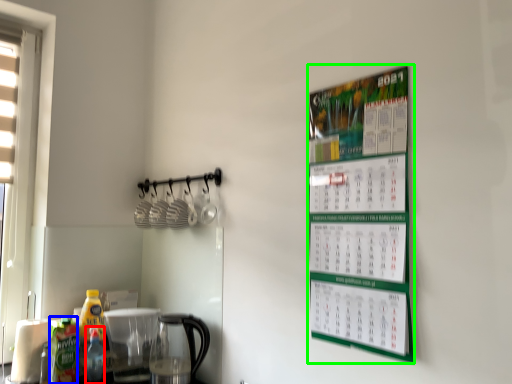
Question: Based on their relative distances, which object is nearer to bottle (highlighted by a red box)? Choose from bottle (highlighted by a blue box) and bulletin board (highlighted by a green box).

Choices:
 (A) bottle
 (B) bulletin board

Answer: (A)